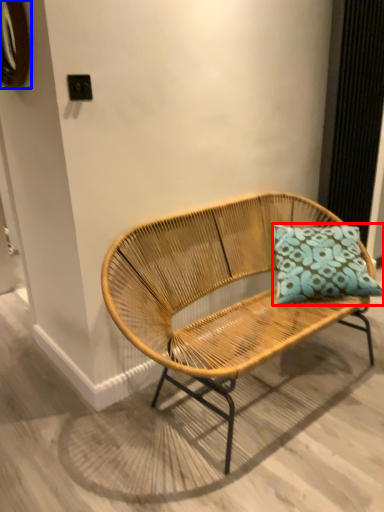
Question: Which object is closer to the camera taking this photo, pillow (highlighted by a red box) or oval (highlighted by a blue box)?

Choices:
 (A) pillow
 (B) oval

Answer: (B)